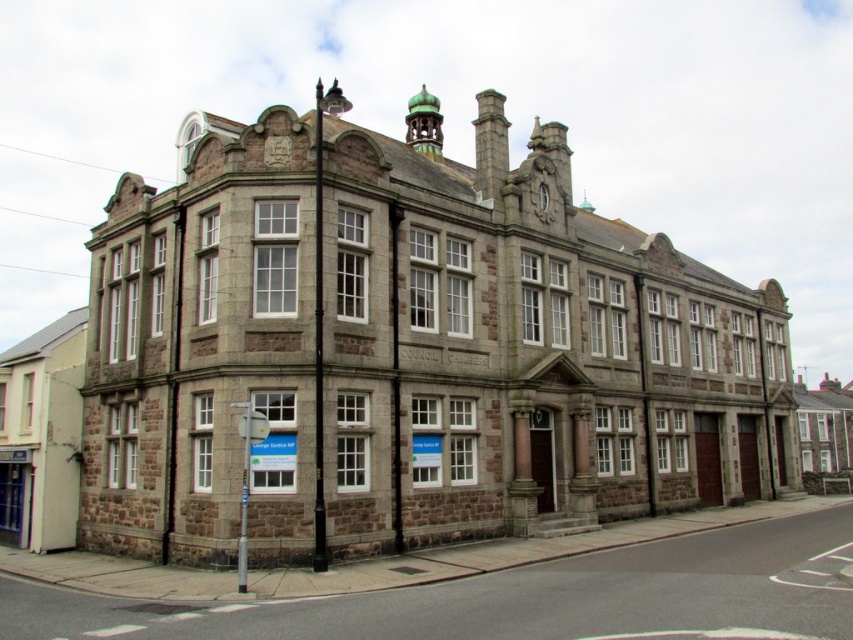
Question: Is metallic silver sign at lower left above dark gray stone clock at upper center?

Choices:
 (A) yes
 (B) no

Answer: (B)

Question: Which of the following is the farthest from the observer?

Choices:
 (A) dark gray stone clock at upper center
 (B) metallic silver sign at lower left

Answer: (A)

Question: Which point is farther to the camera?

Choices:
 (A) dark gray stone clock at upper center
 (B) metallic silver sign at lower left

Answer: (A)

Question: Can you confirm if metallic silver sign at lower left is thinner than dark gray stone clock at upper center?

Choices:
 (A) no
 (B) yes

Answer: (A)

Question: Can you confirm if metallic silver sign at lower left is thinner than dark gray stone clock at upper center?

Choices:
 (A) yes
 (B) no

Answer: (B)